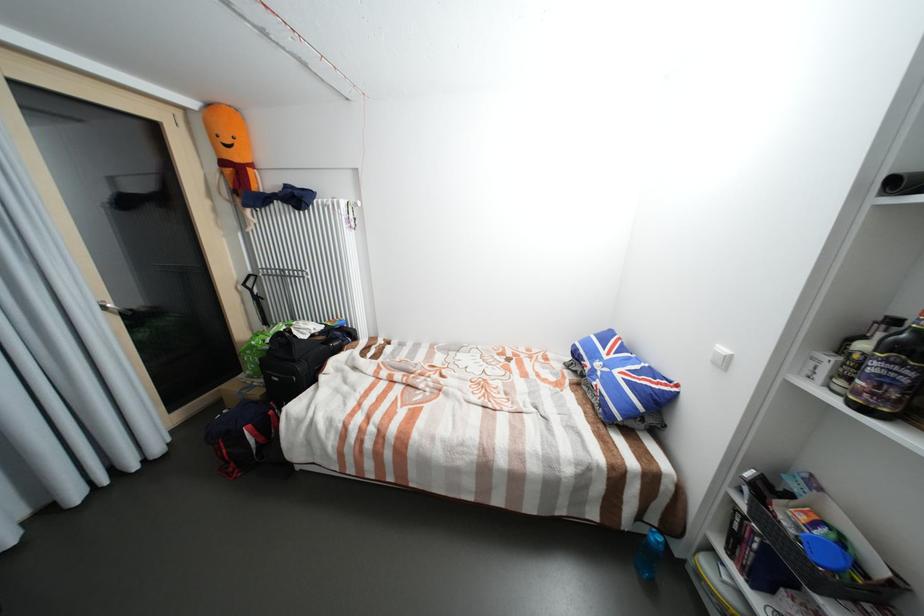
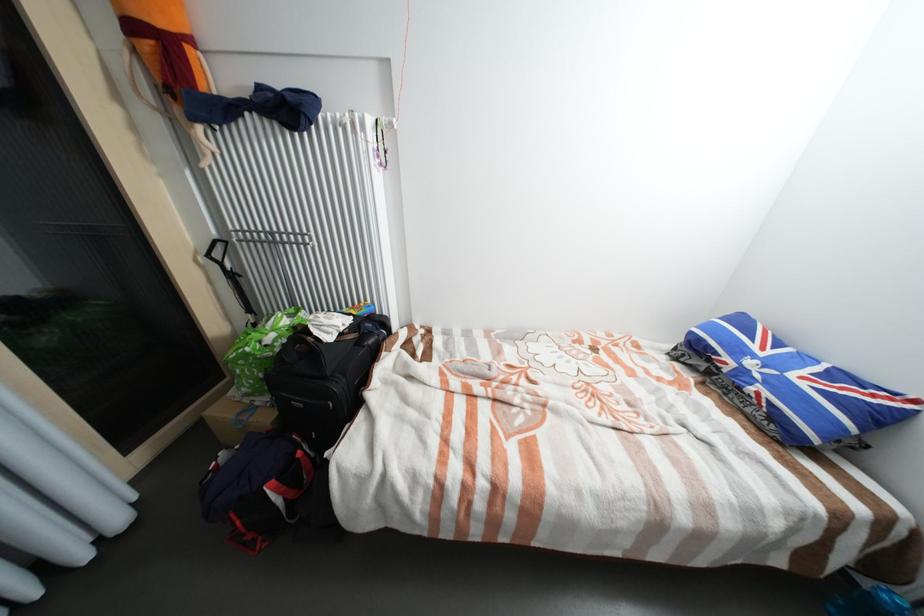
Find the pixel in the second image that matches [613,358] in the first image.

(769, 354)